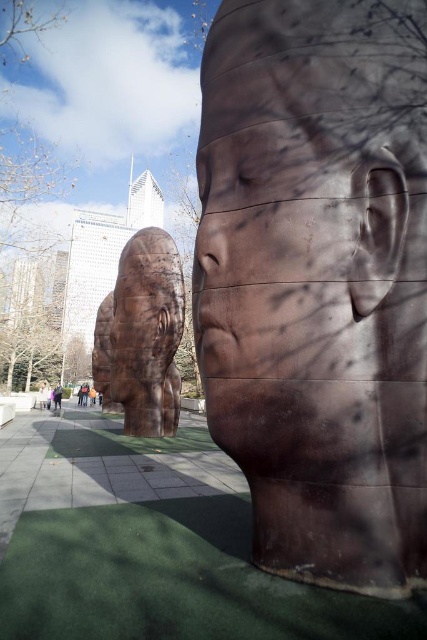
You are an art student standing in front of the urban sculpture installation. You notice two sculptures, the rusty metal face at center and the rusty metal head at center. Which sculpture is positioned to the right side?

The rusty metal face at center is positioned to the right of the rusty metal head at center.

Where is the rusty metal face at center located in the image?

The rusty metal face at center is located at point [310,218] in the image.